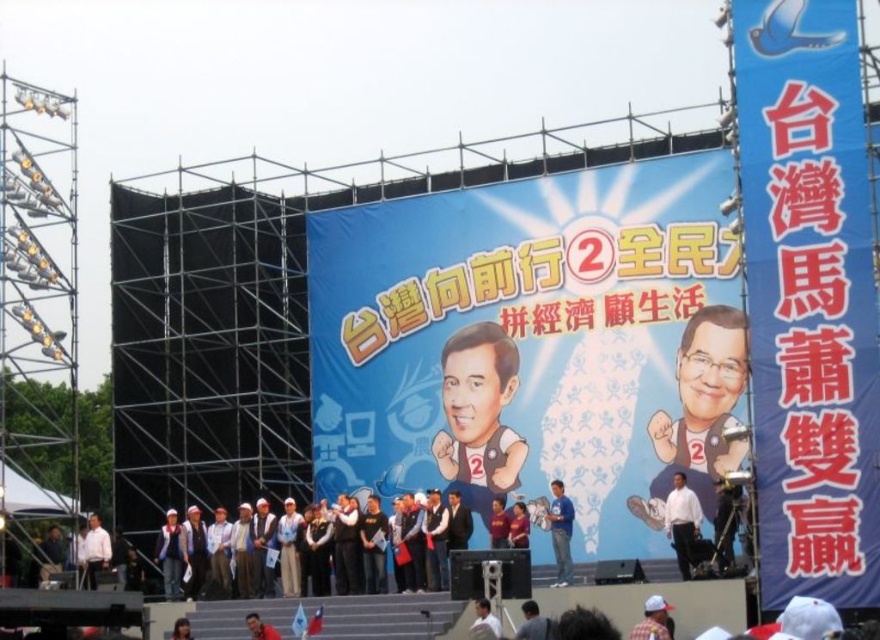
Question: Estimate the real-world distances between objects in this image. Which object is closer to the dark gray fabric jacket at lower center?

Choices:
 (A) white fabric jacket at lower left
 (B) white shirt at center

Answer: (A)

Question: Which point is farther to the camera?

Choices:
 (A) matte yellow shirt at center
 (B) white fabric shirt at lower center

Answer: (A)

Question: Can you confirm if white matte shirt at center is bigger than white fabric jacket at lower left?

Choices:
 (A) yes
 (B) no

Answer: (A)

Question: Does matte red shirt at center come behind light brown hair at lower left?

Choices:
 (A) yes
 (B) no

Answer: (B)

Question: Which of the following is the closest to the observer?

Choices:
 (A) (481, 616)
 (B) (519, 637)
 (C) (559, 563)

Answer: (B)

Question: Does matte yellow shirt at center appear on the right side of white matte shirt at center?

Choices:
 (A) yes
 (B) no

Answer: (B)